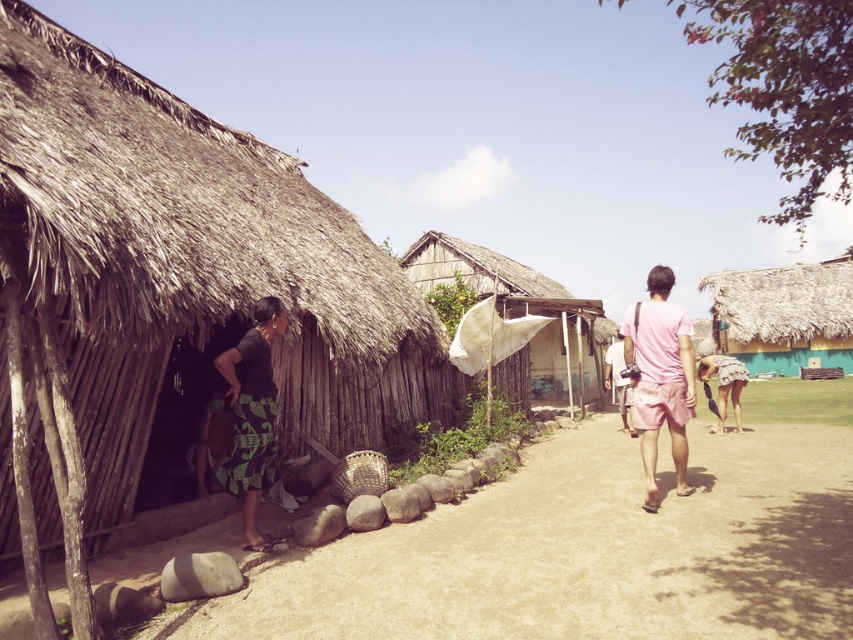
Is thatched wood hut at center taller than pink cotton shirt at center?

Yes, thatched wood hut at center is taller than pink cotton shirt at center.

Who is more distant from viewer, (523,282) or (619,388)?

Positioned behind is point (523,282).

Where is `thatched wood hut at center`? Image resolution: width=853 pixels, height=640 pixels. thatched wood hut at center is located at coordinates (520, 308).

Who is lower down, brown dirt path at lower center or thatched wood hut at center?

brown dirt path at lower center is below.

Who is more forward, (410,548) or (552,332)?

Point (410,548) is more forward.

Which is behind, point (705, 579) or point (541, 330)?

The point (541, 330) is behind.

This screenshot has height=640, width=853. What are the coordinates of `brown dirt path at lower center` in the screenshot? It's located at (584, 552).

Between brown dirt path at lower center and green printed skirt at lower left, which one is positioned lower?

brown dirt path at lower center is below.

Which of these two, brown dirt path at lower center or green printed skirt at lower left, stands shorter?

brown dirt path at lower center

Identify the location of brown dirt path at lower center. (584, 552).